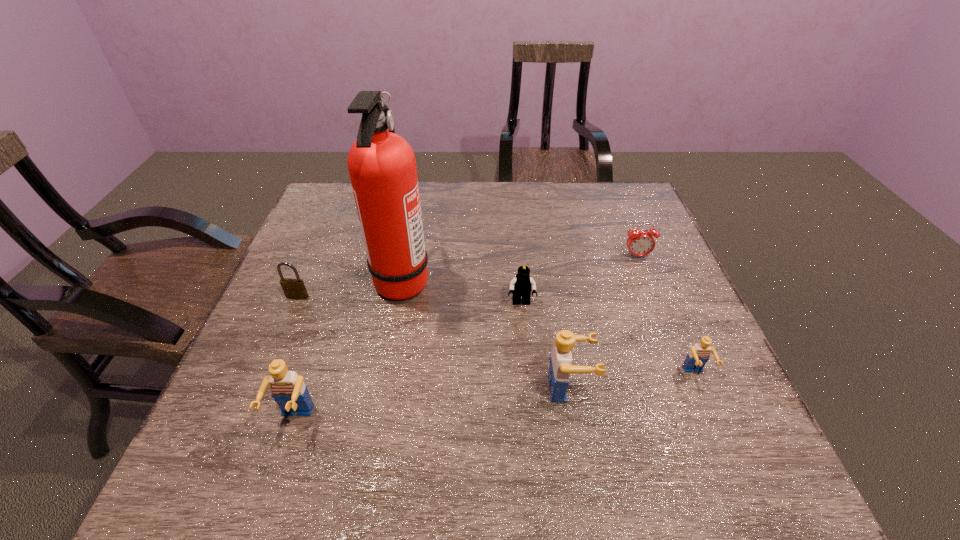
The image size is (960, 540). What are the coordinates of `free space at the far edge` in the screenshot? It's located at (560, 203).

At what (x,y) coordinates should I click in order to perform the action: click on free space at the near edge of the desktop. Please return your answer as a coordinate pair (x, y). The width and height of the screenshot is (960, 540). Looking at the image, I should click on (306, 419).

In order to click on free space at the left edge of the desktop in this screenshot , I will do `click(242, 384)`.

This screenshot has width=960, height=540. Find the location of `vacant space at the right edge`. vacant space at the right edge is located at coordinates (682, 302).

Image resolution: width=960 pixels, height=540 pixels. In the image, there is a desktop. Identify the location of vacant space at the far right corner. (586, 183).

Locate an element on the screen. The width and height of the screenshot is (960, 540). free space between the fifth object from left to right and the tallest object is located at coordinates (486, 334).

Where is `free spot between the fourth object from left to right and the third Lego from left to right`? The width and height of the screenshot is (960, 540). free spot between the fourth object from left to right and the third Lego from left to right is located at coordinates (545, 346).

Locate an element on the screen. The height and width of the screenshot is (540, 960). vacant space that's between the alarm clock and the fifth object from left to right is located at coordinates (603, 322).

Locate an element on the screen. The image size is (960, 540). vacant space in between the alarm clock and the second tallest Lego is located at coordinates (466, 338).

The image size is (960, 540). Find the location of `vacant point located between the fifth object from right to left and the fifth object from left to right`. vacant point located between the fifth object from right to left and the fifth object from left to right is located at coordinates (486, 334).